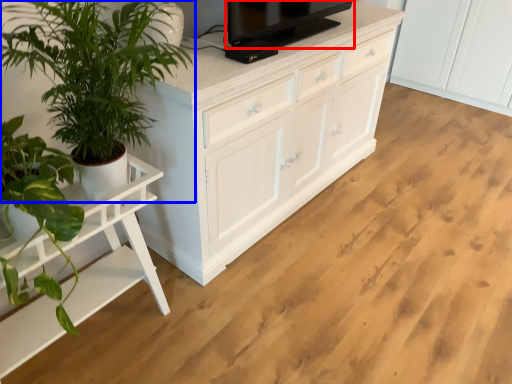
Question: Which object is further to the camera taking this photo, television (highlighted by a red box) or houseplant (highlighted by a blue box)?

Choices:
 (A) television
 (B) houseplant

Answer: (A)